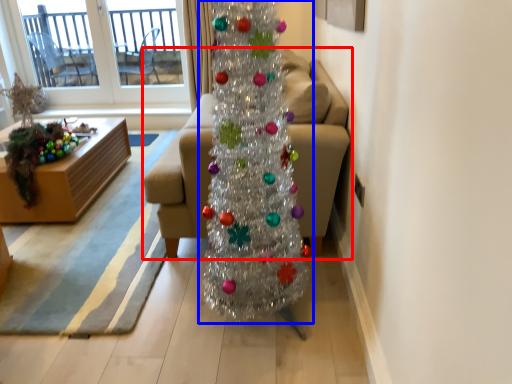
Question: Which object appears farthest to the camera in this image, studio couch (highlighted by a red box) or christmas tree (highlighted by a blue box)?

Choices:
 (A) studio couch
 (B) christmas tree

Answer: (A)